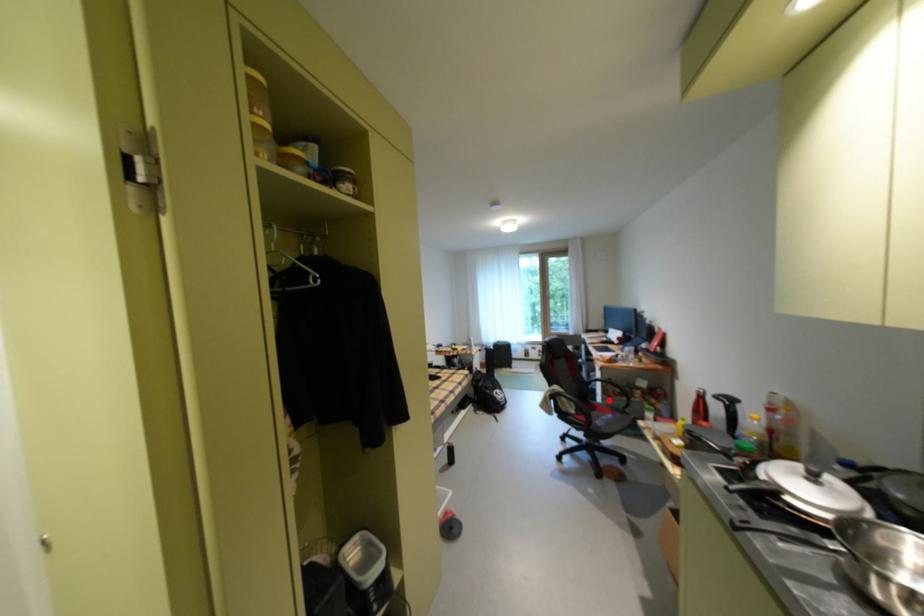
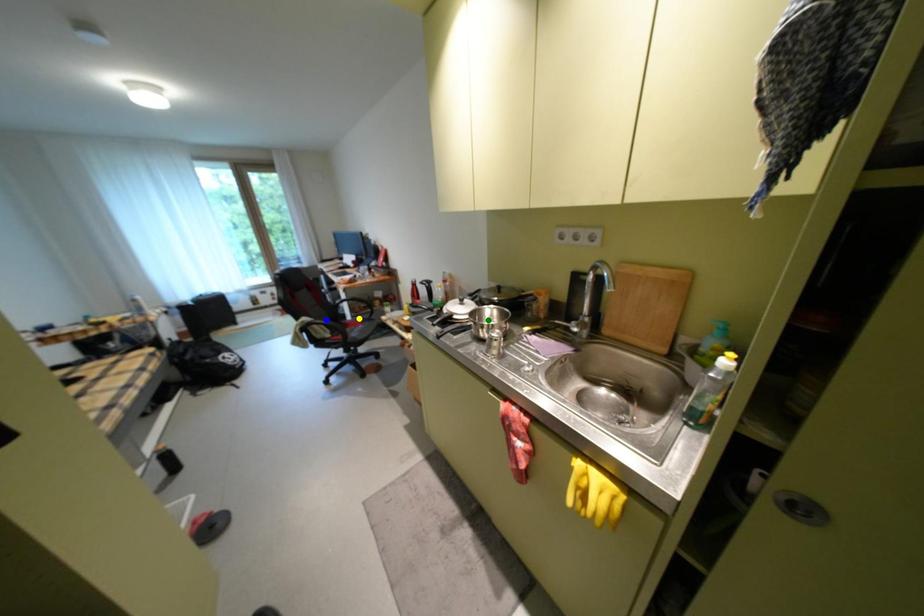
Question: I am providing you with two images of the same scene from different viewpoints. A red point is marked on the first image. You are given multiple points on the second image. Which spot in image 2 lines up with the point in image 1?

Choices:
 (A) green point
 (B) blue point
 (C) yellow point

Answer: (C)